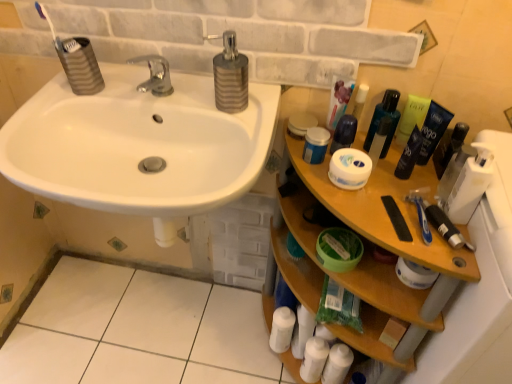
At what (x,y) coordinates should I click in order to perform the action: click on unoccupied region to the right of white matte jar at upper right, the 1th mouthwash positioned from the left. Please return your answer as a coordinate pair (x, y). The image size is (512, 384). Looking at the image, I should click on (398, 175).